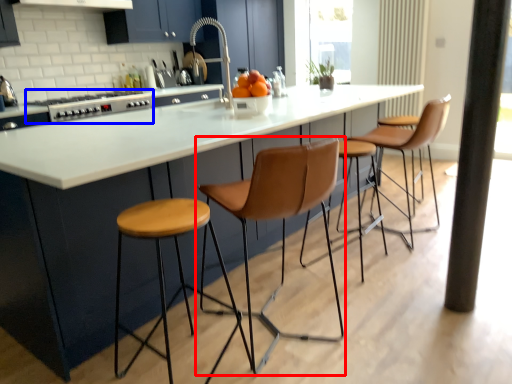
Question: Which object is closer to the camera taking this photo, chair (highlighted by a red box) or appliance (highlighted by a blue box)?

Choices:
 (A) chair
 (B) appliance

Answer: (A)